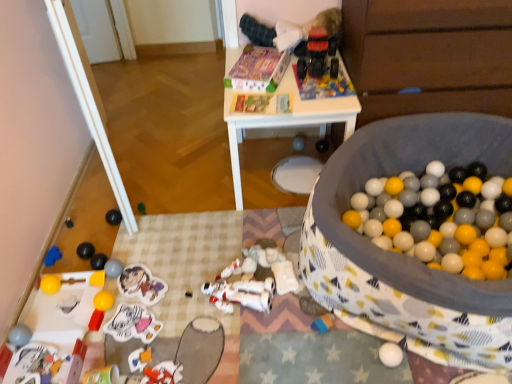
Identify the location of free spot in front of yellow rubber ball at lower left, positioned as the 9th toy in left-to-right order. This screenshot has width=512, height=384. pyautogui.click(x=105, y=344).